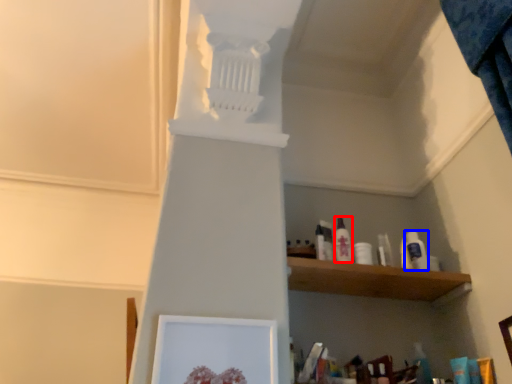
Question: Among these objects, which one is nearest to the camera, toiletry (highlighted by a red box) or toiletry (highlighted by a blue box)?

Choices:
 (A) toiletry
 (B) toiletry

Answer: (A)